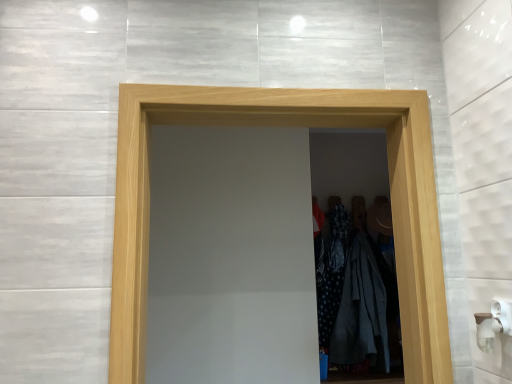
Question: Is wooden door at center wider or thinner than dark gray fabric coat at center?

Choices:
 (A) thin
 (B) wide

Answer: (B)

Question: From the image's perspective, relative to dark gray fabric coat at center, is wooden door at center above or below?

Choices:
 (A) above
 (B) below

Answer: (A)

Question: Is point (406, 342) closer or farther from the camera than point (333, 317)?

Choices:
 (A) closer
 (B) farther

Answer: (A)

Question: In terms of width, does dark gray fabric coat at center look wider or thinner when compared to wooden door at center?

Choices:
 (A) thin
 (B) wide

Answer: (A)

Question: Is dark gray fabric coat at center inside the boundaries of wooden door at center, or outside?

Choices:
 (A) outside
 (B) inside

Answer: (A)

Question: Is point (331, 317) closer or farther from the camera than point (136, 248)?

Choices:
 (A) closer
 (B) farther

Answer: (B)

Question: From a real-world perspective, is dark gray fabric coat at center positioned above or below wooden door at center?

Choices:
 (A) above
 (B) below

Answer: (B)